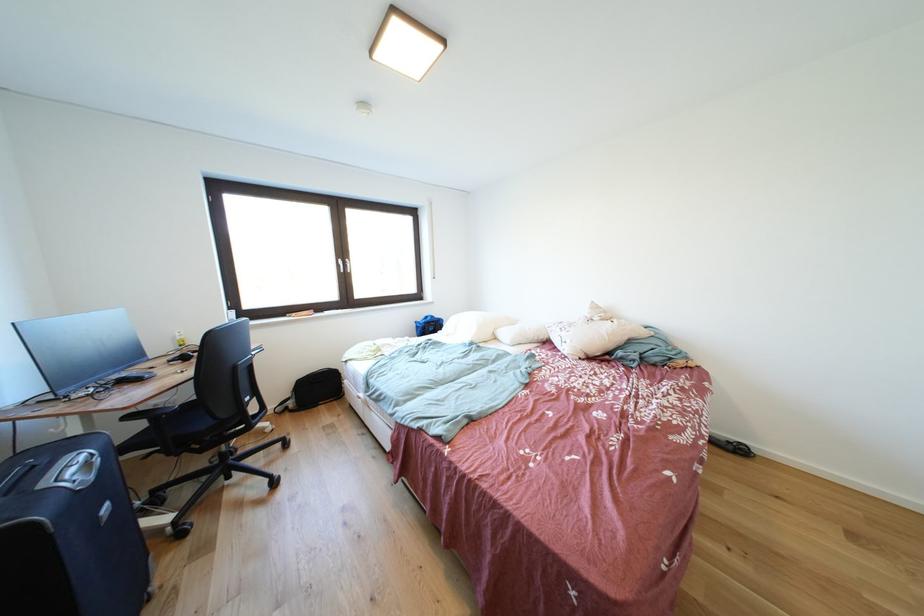
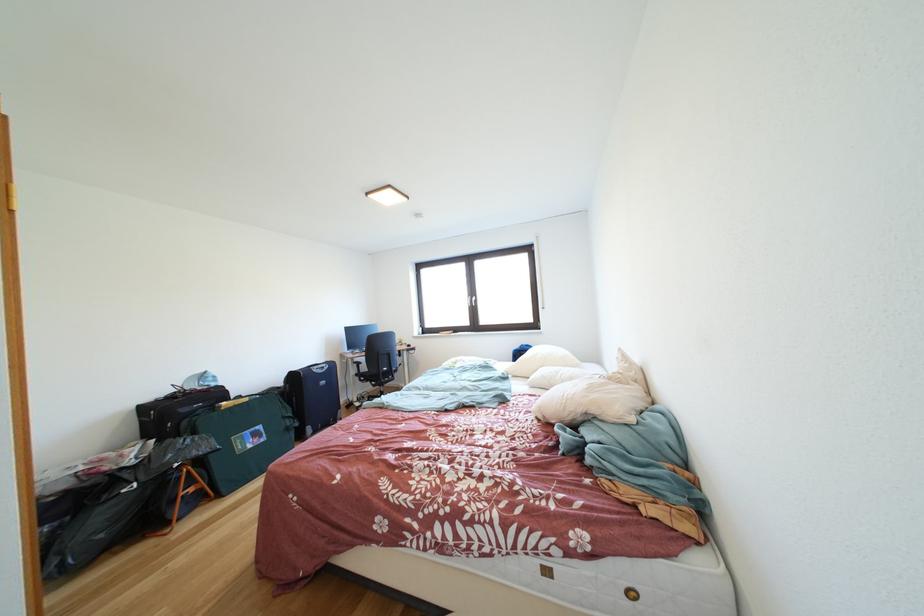
Where in the second image is the point corresponding to [210,455] from the first image?

(383, 391)